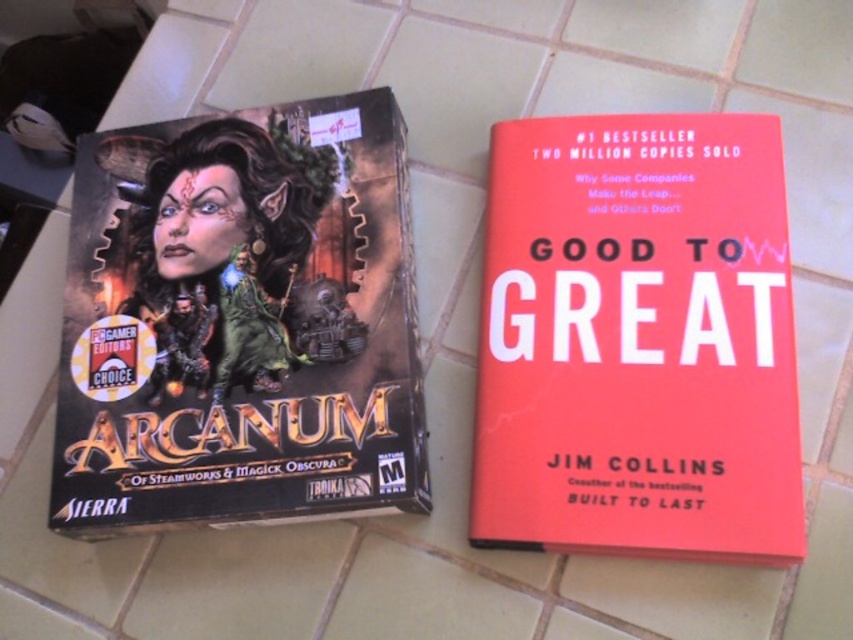
Is the position of hardcover book at center more distant than that of red matte hardcover book at center?

Yes, hardcover book at center is behind red matte hardcover book at center.

Is point (206, 284) more distant than point (749, 246)?

Yes.

Locate an element on the screen. The image size is (853, 640). hardcover book at center is located at coordinates (241, 321).